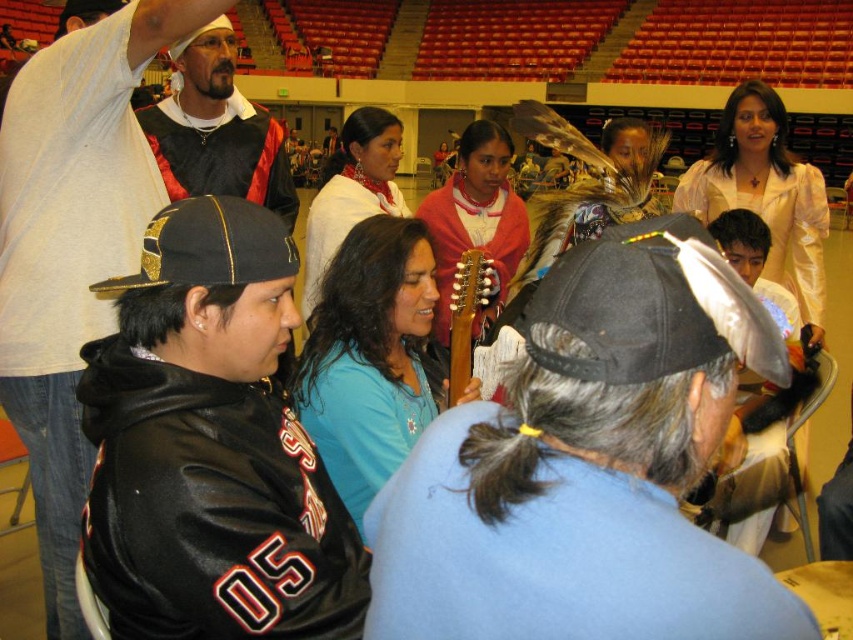
Does point (65, 106) come behind point (244, 248)?

Yes, point (65, 106) is behind point (244, 248).

Is black leather jacket at lower left bigger than black leather baseball cap at center-left?

Indeed, black leather jacket at lower left has a larger size compared to black leather baseball cap at center-left.

Where is `black leather jacket at lower left`? Image resolution: width=853 pixels, height=640 pixels. black leather jacket at lower left is located at coordinates (73, 243).

Where is `black leather jacket at lower left`? black leather jacket at lower left is located at coordinates (73, 243).

Does matte black and red fabric at upper left have a lesser height compared to black leather baseball cap at center-left?

In fact, matte black and red fabric at upper left may be taller than black leather baseball cap at center-left.

Where is `matte black and red fabric at upper left`? This screenshot has height=640, width=853. matte black and red fabric at upper left is located at coordinates (218, 129).

Locate an element on the screen. Image resolution: width=853 pixels, height=640 pixels. matte black and red fabric at upper left is located at coordinates (218, 129).

Can you confirm if black leather jacket at lower left is taller than matte black and red fabric at upper left?

Correct, black leather jacket at lower left is much taller as matte black and red fabric at upper left.

This screenshot has height=640, width=853. What do you see at coordinates (73, 243) in the screenshot?
I see `black leather jacket at lower left` at bounding box center [73, 243].

You are a GUI agent. You are given a task and a screenshot of the screen. Output one action in this format:
    pyautogui.click(x=<x>, y=<y>)
    Task: Click on the black leather jacket at lower left
    The image size is (853, 640).
    Given the screenshot: What is the action you would take?
    pyautogui.click(x=73, y=243)